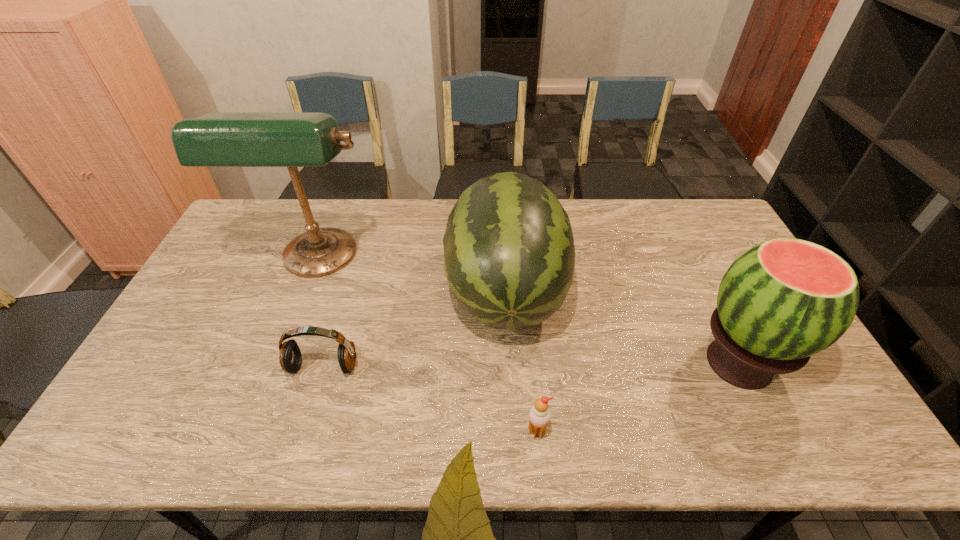
Locate an element on the screen. The width and height of the screenshot is (960, 540). empty space between the left watermelon and the rightmost object is located at coordinates click(622, 327).

You are a GUI agent. You are given a task and a screenshot of the screen. Output one action in this format:
    pyautogui.click(x=<x>, y=<y>)
    Task: Click on the vacant area between the nearest object and the rightmost object
    This screenshot has width=960, height=540.
    Given the screenshot: What is the action you would take?
    pyautogui.click(x=637, y=397)

This screenshot has height=540, width=960. Identify the location of free spot between the headset and the tallest object. (321, 314).

Find the location of a particular element. free spot between the icecream and the left watermelon is located at coordinates (521, 361).

Image resolution: width=960 pixels, height=540 pixels. In order to click on vacant region between the icecream and the headset in this screenshot , I will do `click(430, 399)`.

Find the location of a particular element. The height and width of the screenshot is (540, 960). unoccupied area between the tallest object and the left watermelon is located at coordinates (412, 276).

Find the location of a particular element. vacant space in between the icecream and the left watermelon is located at coordinates (521, 361).

Where is `object that is the fourth nearest to the left watermelon`? The image size is (960, 540). object that is the fourth nearest to the left watermelon is located at coordinates (784, 300).

I want to click on object that is the third nearest to the left watermelon, so click(x=290, y=358).

Locate an element on the screen. free space in the image that satisfies the following two spatial constraints: 1. above the green lampshade of the table lamp; 2. on the right side of the left watermelon is located at coordinates (305, 292).